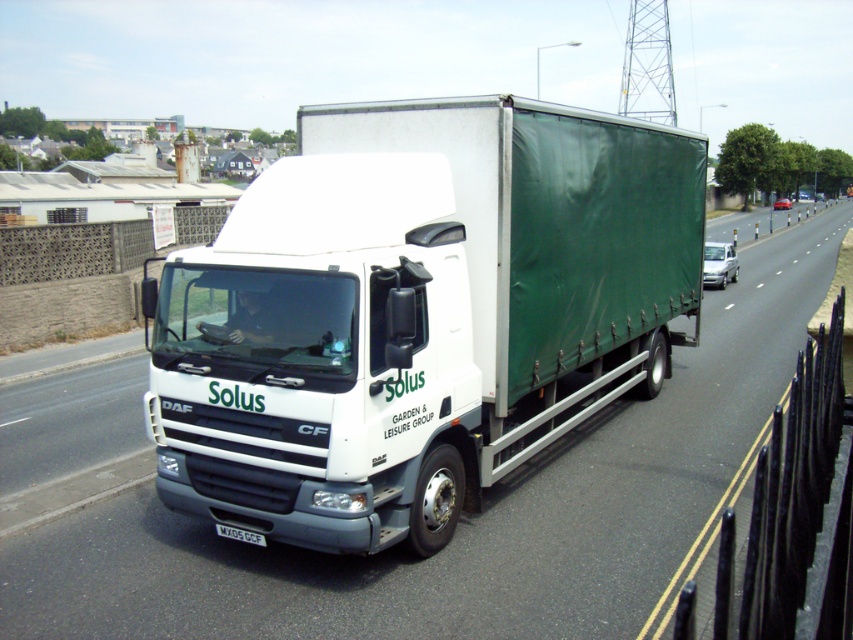
Is white truck at center bigger than white plastic license plate at center?

Yes.

Does white truck at center have a lesser height compared to white plastic license plate at center?

No.

Between point (0, 476) and point (259, 544), which one is positioned in front?

Point (259, 544) is in front.

This screenshot has height=640, width=853. I want to click on white truck at center, so click(x=463, y=515).

Between white matte truck at center and white truck at center, which one appears on the right side from the viewer's perspective?

white truck at center

Which is above, white matte truck at center or white truck at center?

white truck at center is higher up.

Is point (442, 147) closer to camera compared to point (241, 618)?

No, (442, 147) is further to viewer.

Locate an element on the screen. The width and height of the screenshot is (853, 640). white matte truck at center is located at coordinates (416, 314).

Which is behind, point (492, 208) or point (235, 536)?

Positioned behind is point (492, 208).

Measure the distance between point [358,497] and camera.

5.08 meters

Where is `white matte truck at center`? white matte truck at center is located at coordinates (416, 314).